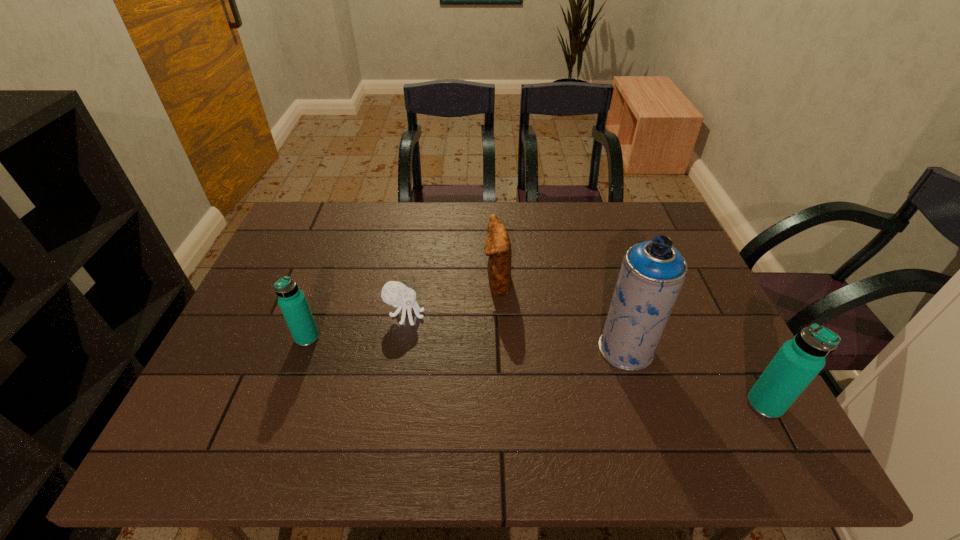
Locate an element on the screen. vacant area located 0.330m on the back of the shorter water bottle is located at coordinates (340, 247).

This screenshot has width=960, height=540. I want to click on vacant space located on the left of the rightmost object, so click(x=625, y=404).

Locate an element on the screen. Image resolution: width=960 pixels, height=540 pixels. free space located on the open side of the farthest object is located at coordinates (357, 282).

Image resolution: width=960 pixels, height=540 pixels. In order to click on free space located 0.240m on the open side of the farthest object in this screenshot , I will do `click(399, 282)`.

This screenshot has width=960, height=540. I want to click on vacant space located 0.360m on the open side of the farthest object, so click(357, 282).

At what (x,y) coordinates should I click in order to perform the action: click on vacant area situated 0.050m on the left of the tallest object. Please return your answer as a coordinate pair (x, y). Looking at the image, I should click on (579, 349).

This screenshot has height=540, width=960. Find the location of `vacant space located 0.280m on the front-facing side of the second farthest object`. vacant space located 0.280m on the front-facing side of the second farthest object is located at coordinates (530, 315).

Where is `object located at the near edge`? The height and width of the screenshot is (540, 960). object located at the near edge is located at coordinates [798, 361].

Locate an element on the screen. object that is at the right edge is located at coordinates (798, 361).

The image size is (960, 540). I want to click on object that is at the near right corner, so click(798, 361).